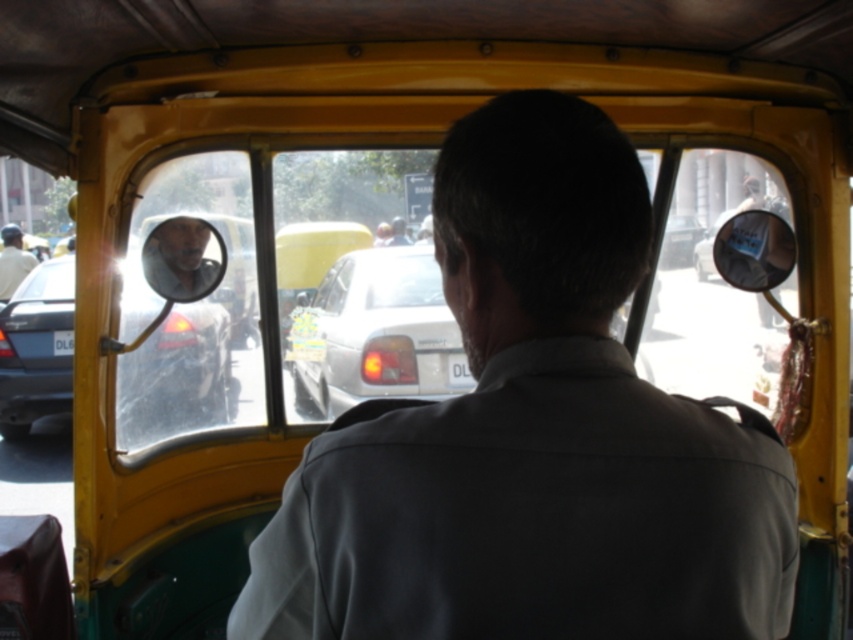
You are sitting inside the yellow auto rickshaw and looking out through the rear window. There are two points marked on the window. The first point is at coordinates point [22,276] and the second point is at point [450,385]. Which of these two points is closer to you?

Point [22,276] is closer to you because it is further to the viewer than point [450,385].

You are a passenger in the tuk tuk and want to see the license plate of the car in front. Which object is closer to the rear window of the tuk tuk, the matte black car at left or the white plastic license plate at center?

The white plastic license plate at center is closer to the rear window of the tuk tuk because the matte black car at left is below it, meaning it is further away from the window.

You are a passenger in the yellow auto rickshaw and want to see the white plastic license plate at center through the rear window. Is the light beige shirt at left blocking your view of the license plate?

The light beige shirt at left is further to the viewer than white plastic license plate at center, so it is blocking the view of the license plate.